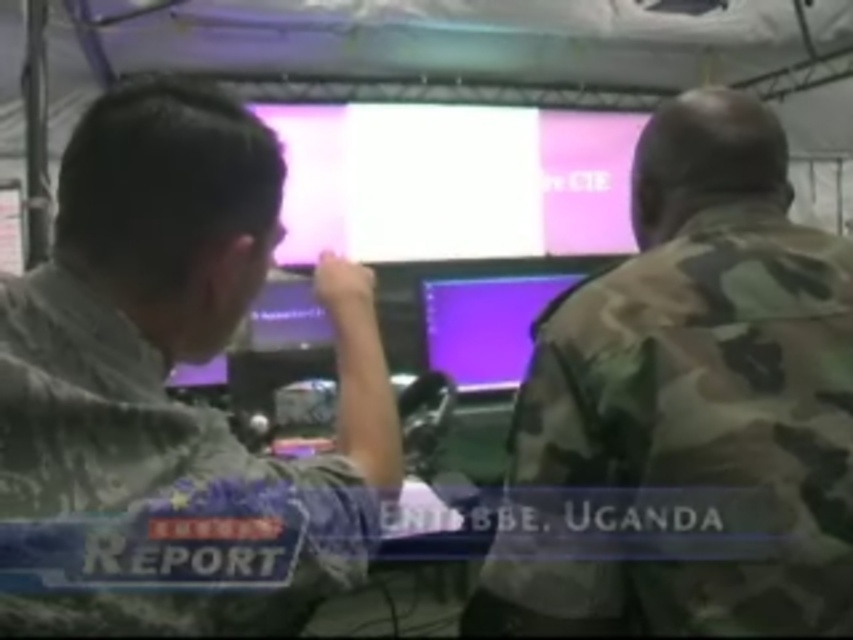
Question: Observing the image, what is the correct spatial positioning of camo uniform at center in reference to pink glossy monitor at center?

Choices:
 (A) left
 (B) right

Answer: (B)

Question: Can you confirm if camouflage uniform at center is positioned to the right of camo uniform at center?

Choices:
 (A) yes
 (B) no

Answer: (B)

Question: Among these objects, which one is nearest to the camera?

Choices:
 (A) purple glossy monitor at center
 (B) camouflage uniform at center
 (C) camo uniform at center

Answer: (B)

Question: Based on their relative distances, which object is farther from the camo uniform at center?

Choices:
 (A) pink glossy monitor at center
 (B) purple glossy monitor at center
 (C) camouflage uniform at center

Answer: (A)

Question: Which point is farther from the camera taking this photo?

Choices:
 (A) (509, 276)
 (B) (178, 100)
 (C) (811, 404)
 (D) (532, 144)

Answer: (D)

Question: Where is camouflage uniform at center located in relation to pink glossy monitor at center in the image?

Choices:
 (A) above
 (B) below

Answer: (B)